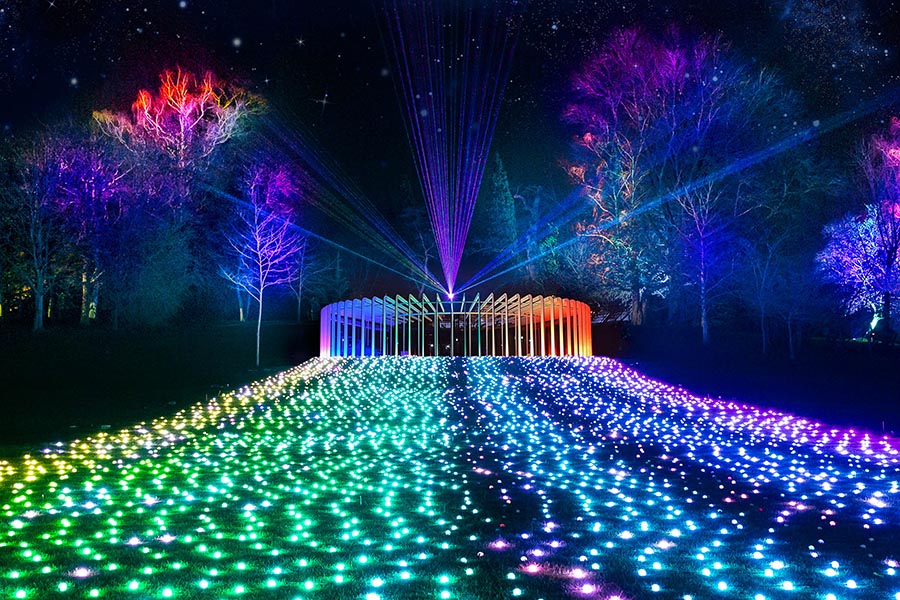
The width and height of the screenshot is (900, 600). I want to click on circle of lights, so click(445, 331).